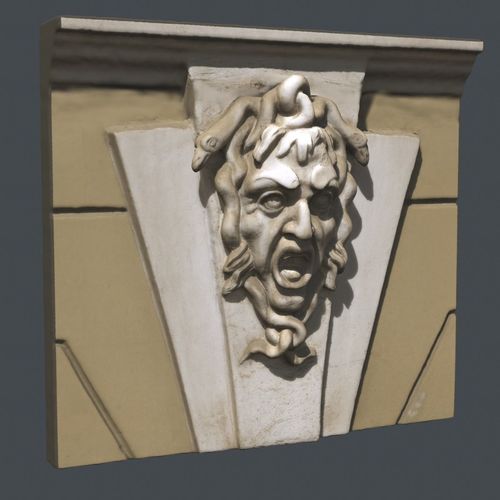
Where is `background wall`? The image size is (500, 500). background wall is located at coordinates (364, 457), (21, 228), (358, 13), (485, 207).